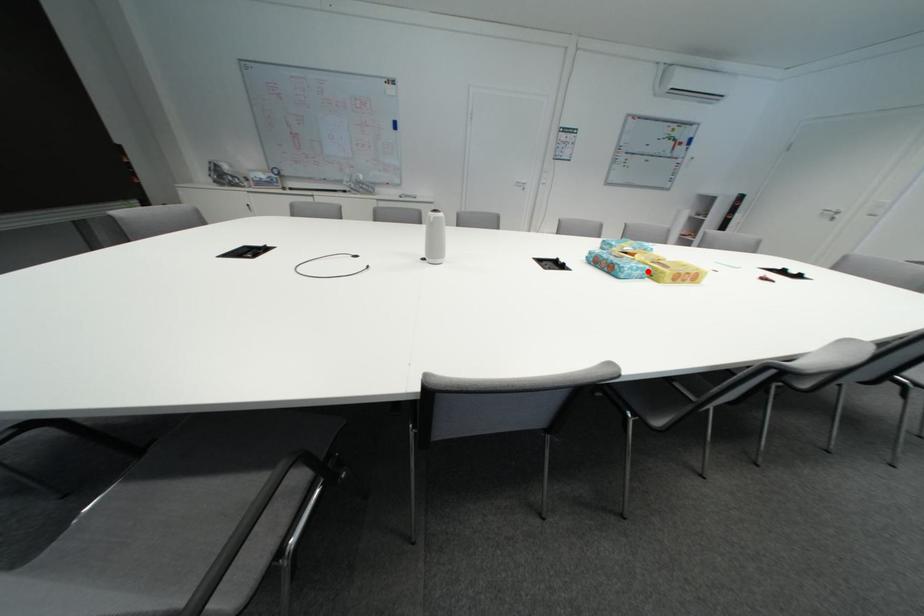
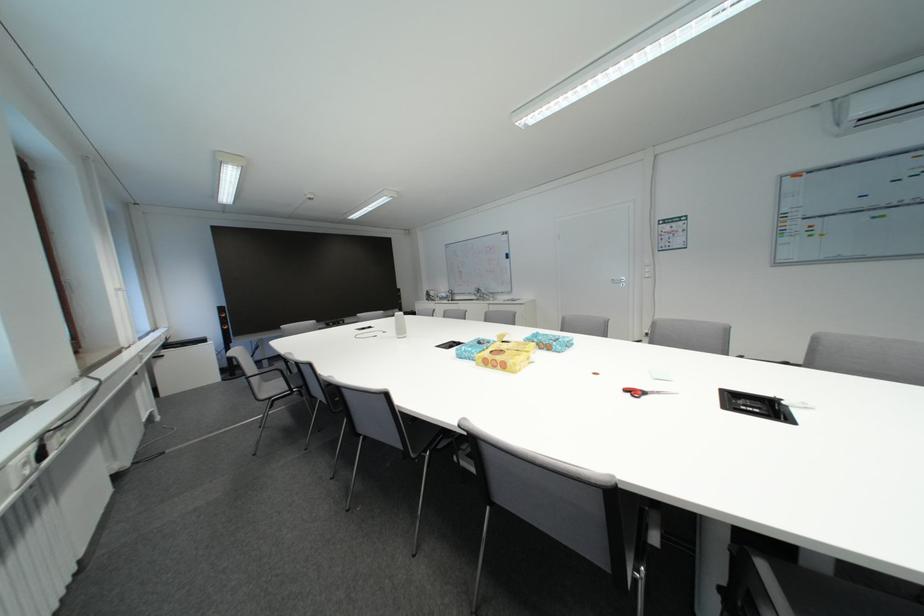
The point at the highlighted location is marked in the first image. Where is the corresponding point in the second image?

(476, 354)